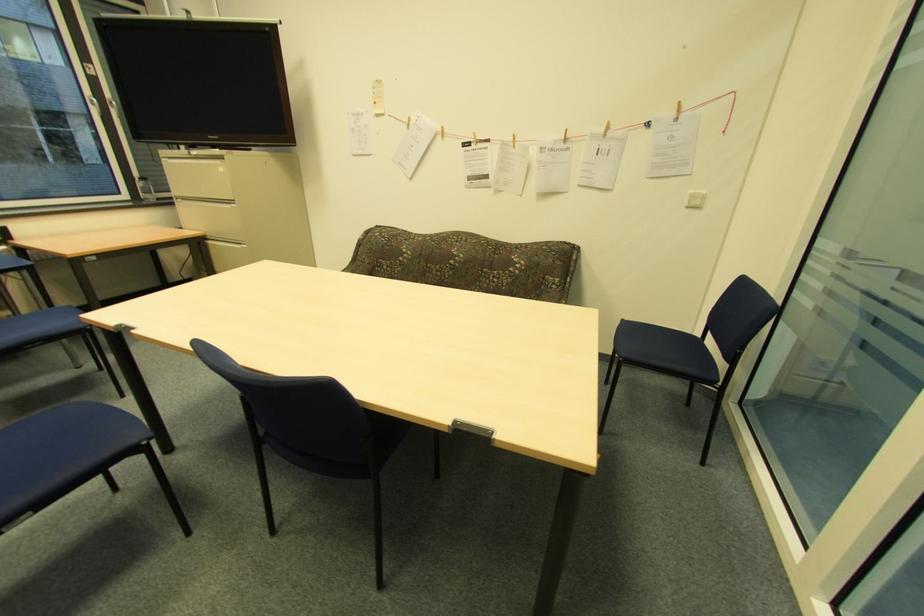
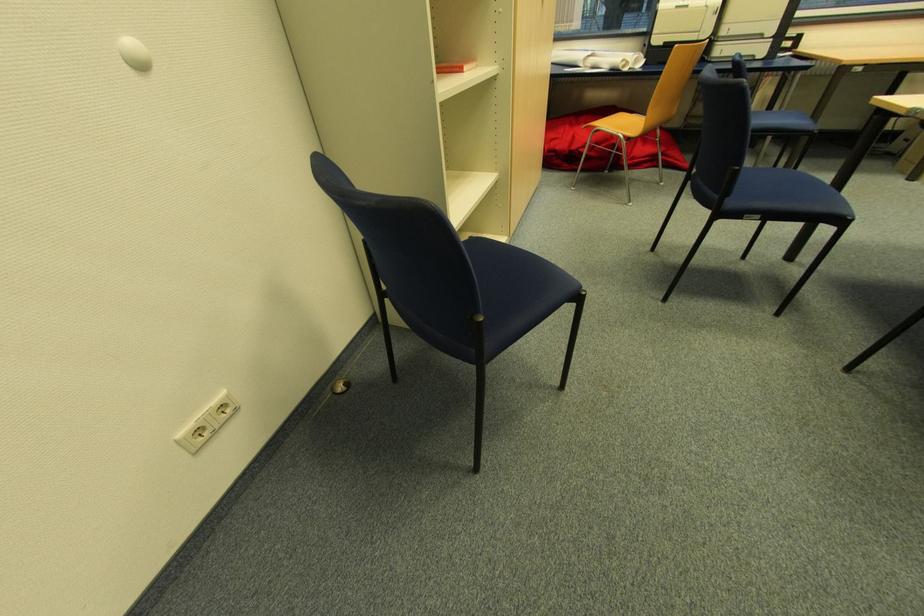
Based on the continuous images, in which direction is the camera rotating?

The rotation direction of the camera is left-down.